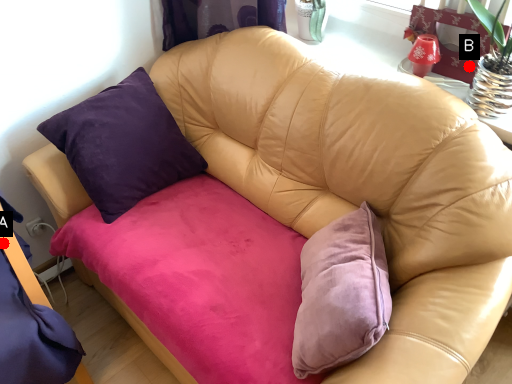
Question: Two points are circled on the image, labeled by A and B beside each circle. Which of the following is the farthest from the observer?

Choices:
 (A) A is further
 (B) B is further

Answer: (B)